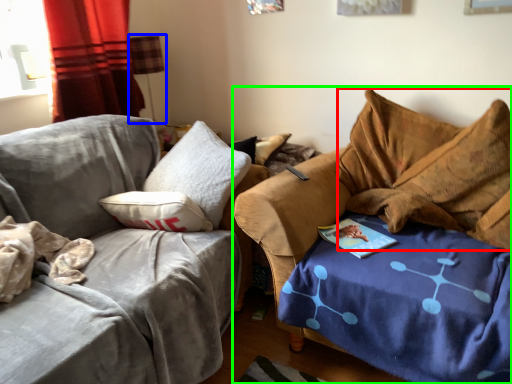
Question: Which object is positioned closest to bean bag chair (highlighted by a red box)? Select from lamp (highlighted by a blue box) and studio couch (highlighted by a green box).

Choices:
 (A) lamp
 (B) studio couch

Answer: (B)